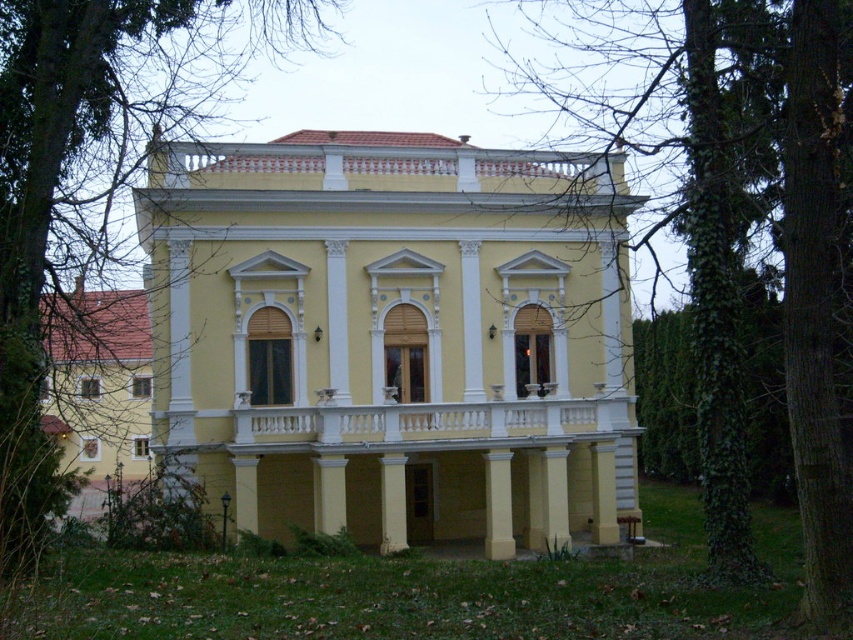
You are a gardener assessing the growth of the green ivy plants on the building. Which of the two green ivy plants, the green ivy at center or the green ivy at upper left, has a greater height?

The green ivy at center is much taller than the green ivy at upper left according to the description provided.

You are an architect inspecting the building from the front. You notice the yellow matte building at center and the green ivy at center. Which object is closer to the ground?

The yellow matte building at center is positioned under the green ivy at center, so the yellow matte building at center is closer to the ground.

You are standing in front of the two story building and want to take a photo of the yellow matte building at center and the green ivy at upper left. Which one should you position to the right side of your camera frame?

You should position the yellow matte building at center to the right side of your camera frame because the yellow matte building at center is to the right of green ivy at upper left.